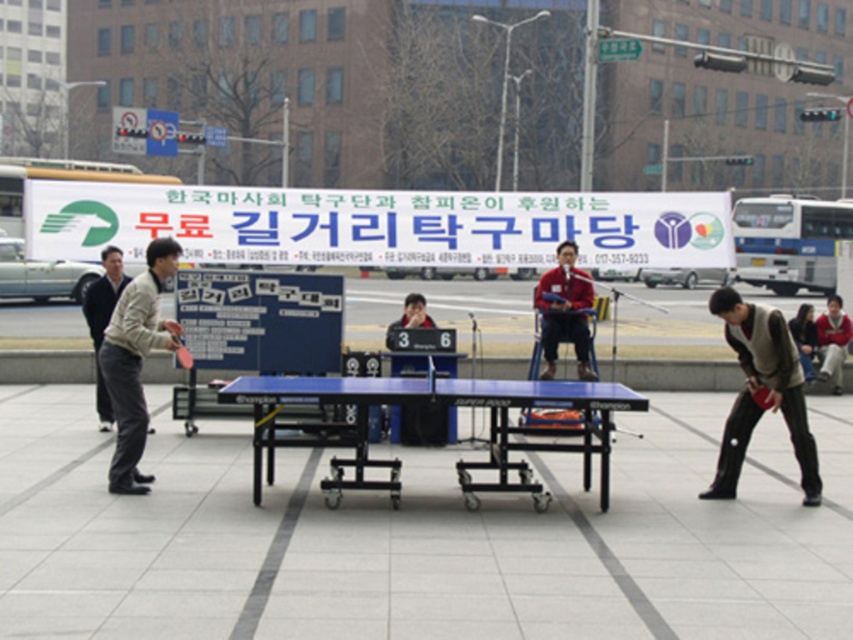
You are a maintenance worker who needs to move both the blue rubber table at center and the blue glossy table tennis table at center to store them for the night. The storage area is 10 feet away from their current position. Can you move them one by one without needing assistance?

The blue rubber table at center is 8.64 feet from the blue glossy table tennis table at center. Since the storage area is 10 feet away, you can move each table individually to the storage area as the distance between them is less than 10 feet, so you can move them one by one without needing assistance.

You are standing at the point labeled as point (x=840, y=349) in the image. Looking towards the table tennis table, can you see the other point labeled point (x=447, y=390) directly in front of you?

Yes, the point (x=447, y=390) is directly in front of point (x=840, y=349), so you can see it directly in front of you.